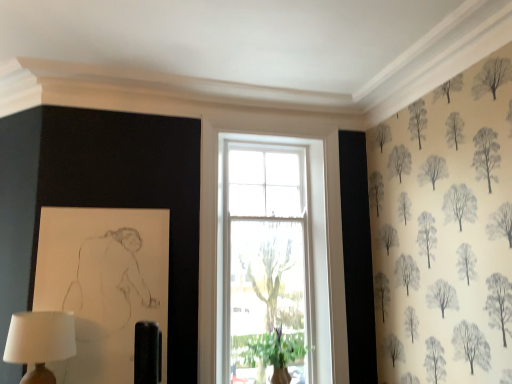
Where is `green leafy plant at window`? This screenshot has width=512, height=384. green leafy plant at window is located at coordinates (276, 352).

The width and height of the screenshot is (512, 384). What do you see at coordinates (276, 352) in the screenshot? I see `green leafy plant at window` at bounding box center [276, 352].

This screenshot has width=512, height=384. Find the location of `matte white lampshade at lower left`. matte white lampshade at lower left is located at coordinates (40, 342).

Describe the element at coordinates (40, 342) in the screenshot. The height and width of the screenshot is (384, 512). I see `matte white lampshade at lower left` at that location.

Identify the location of green leafy plant at window. The image size is (512, 384). (276, 352).

Is green leafy plant at window to the left of matte white lampshade at lower left from the viewer's perspective?

No, green leafy plant at window is not to the left of matte white lampshade at lower left.

Is green leafy plant at window positioned behind matte white lampshade at lower left?

That is True.

Considering the positions of point (277, 371) and point (22, 346), is point (277, 371) closer or farther from the camera than point (22, 346)?

Point (277, 371) is farther from the camera than point (22, 346).

From the image's perspective, which object appears higher, green leafy plant at window or matte white lampshade at lower left?

matte white lampshade at lower left is shown above in the image.

From a real-world perspective, who is located lower, green leafy plant at window or matte white lampshade at lower left?

In real-world perspective, green leafy plant at window is lower.

Looking at their sizes, would you say green leafy plant at window is wider or thinner than matte white lampshade at lower left?

Considering their sizes, green leafy plant at window looks broader than matte white lampshade at lower left.

From their relative heights in the image, would you say green leafy plant at window is taller or shorter than matte white lampshade at lower left?

Clearly, green leafy plant at window is taller compared to matte white lampshade at lower left.

Is green leafy plant at window bigger or smaller than matte white lampshade at lower left?

In the image, green leafy plant at window appears to be larger than matte white lampshade at lower left.

Would you say matte white lampshade at lower left is part of green leafy plant at window's contents?

No, matte white lampshade at lower left is not inside green leafy plant at window.

Looking at this image, is green leafy plant at window not near matte white lampshade at lower left?

Absolutely, green leafy plant at window is distant from matte white lampshade at lower left.

Is green leafy plant at window looking in the opposite direction of matte white lampshade at lower left?

No.

How far apart are green leafy plant at window and matte white lampshade at lower left?

green leafy plant at window is 4.17 feet away from matte white lampshade at lower left.

Where is `table lamp lying on the left of green leafy plant at window`? The image size is (512, 384). table lamp lying on the left of green leafy plant at window is located at coordinates (40, 342).

Which is more to the right, matte white lampshade at lower left or green leafy plant at window?

Positioned to the right is green leafy plant at window.

Is matte white lampshade at lower left positioned behind green leafy plant at window?

No, it is in front of green leafy plant at window.

Is point (35, 377) positioned in front of point (261, 344)?

Yes, point (35, 377) is in front of point (261, 344).

Looking at this image, from the image's perspective, would you say matte white lampshade at lower left is shown under green leafy plant at window?

No, from the image's perspective, matte white lampshade at lower left is not below green leafy plant at window.

From a real-world perspective, is matte white lampshade at lower left over green leafy plant at window?

Yes, from a real-world perspective, matte white lampshade at lower left is on top of green leafy plant at window.

Considering the relative sizes of matte white lampshade at lower left and green leafy plant at window in the image provided, is matte white lampshade at lower left wider than green leafy plant at window?

No.

Between matte white lampshade at lower left and green leafy plant at window, which one has more height?

Standing taller between the two is green leafy plant at window.

Which of these two, matte white lampshade at lower left or green leafy plant at window, is bigger?

Bigger between the two is green leafy plant at window.

Would you say matte white lampshade at lower left is inside or outside green leafy plant at window?

matte white lampshade at lower left is outside green leafy plant at window.

Is matte white lampshade at lower left not close to green leafy plant at window?

That's right, there is a large distance between matte white lampshade at lower left and green leafy plant at window.

Does matte white lampshade at lower left turn towards green leafy plant at window?

No, matte white lampshade at lower left is not facing towards green leafy plant at window.

Can you tell me how much matte white lampshade at lower left and green leafy plant at window differ in facing direction?

4.49e-05 degrees.

Identify the location of plant below the matte white lampshade at lower left (from the image's perspective). (276, 352).

The image size is (512, 384). I want to click on plant below the matte white lampshade at lower left (from the image's perspective), so click(x=276, y=352).

Identify the location of plant on the right of matte white lampshade at lower left. This screenshot has width=512, height=384. (276, 352).